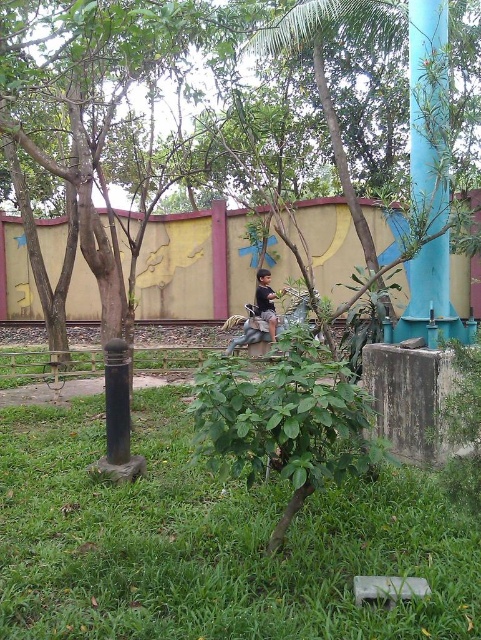
Question: Which point is farther to the camera?

Choices:
 (A) (437, 616)
 (B) (270, 330)
 (C) (428, 305)

Answer: (B)

Question: Which point is closer to the camera?

Choices:
 (A) (422, 140)
 (B) (118, 580)

Answer: (B)

Question: Is blue glossy pole at upper right wider than black cotton shirt at center?

Choices:
 (A) yes
 (B) no

Answer: (A)

Question: Can you confirm if green grass at lower center is thinner than black cotton shirt at center?

Choices:
 (A) no
 (B) yes

Answer: (A)

Question: Considering the real-world distances, which object is closest to the green grass at lower center?

Choices:
 (A) blue glossy pole at upper right
 (B) black cotton shirt at center

Answer: (A)

Question: Does green grass at lower center lie in front of blue glossy pole at upper right?

Choices:
 (A) yes
 (B) no

Answer: (A)